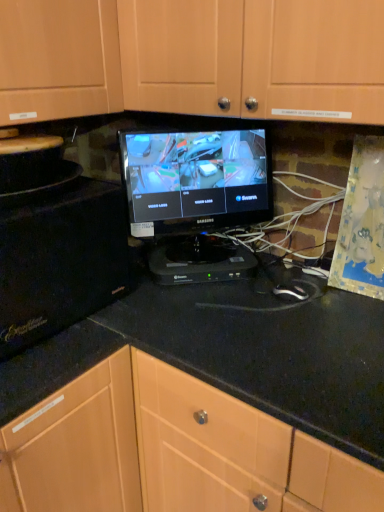
The height and width of the screenshot is (512, 384). I want to click on spots to the right of black plastic mouse at center, so click(x=336, y=300).